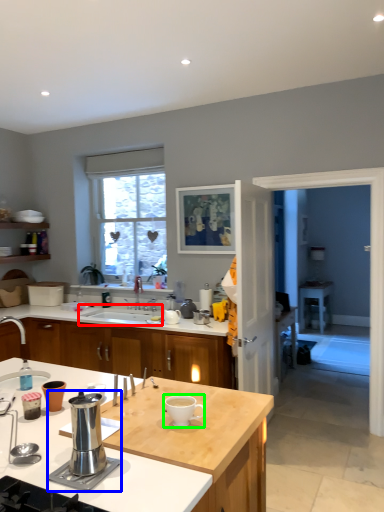
Question: Estimate the real-world distances between objects in this image. Which object is farther from sink (highlighted by a red box), appliance (highlighted by a blue box) or coffee cup (highlighted by a green box)?

Choices:
 (A) appliance
 (B) coffee cup

Answer: (A)